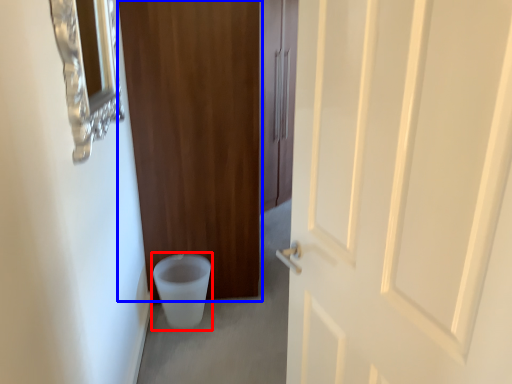
Question: Which object is further to the camera taking this photo, toilet bowl (highlighted by a red box) or door (highlighted by a blue box)?

Choices:
 (A) toilet bowl
 (B) door

Answer: (A)